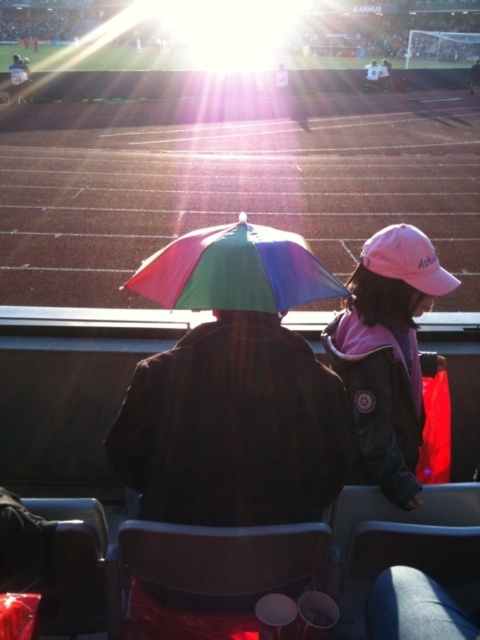
You are a photographer trying to capture a clear shot of the pink fabric cap at upper right without the glare from the sun. Based on the scene description, where should you position yourself relative to the cap to avoid the bright sunlight?

The pink fabric cap at upper right is located at point (388,353), so positioning yourself to the left or below this point would help avoid the glare from the sun positioned in the upper portion of the frame.

You are a photographer trying to capture a clear shot of the pink fabric cap at upper right and the rainbow fabric umbrella at center. Since the sun is behind you, which object should you focus on first to avoid the glare from the sun?

The pink fabric cap at upper right should be focused on first because it is located below the rainbow fabric umbrella at center, so the glare from the sun might affect the rainbow fabric umbrella at center more due to its higher position.